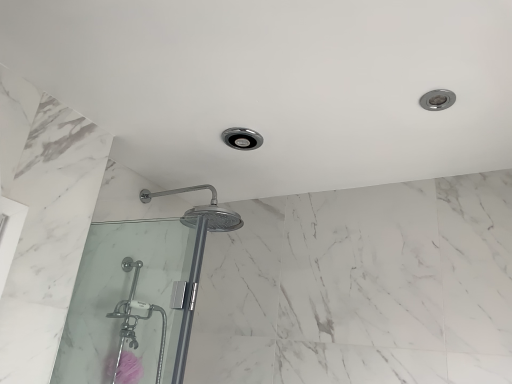
Question: Is pink matte flower at lower left further to the viewer compared to clear glass shower door at lower left?

Choices:
 (A) no
 (B) yes

Answer: (B)

Question: Is pink matte flower at lower left positioned beyond the bounds of clear glass shower door at lower left?

Choices:
 (A) no
 (B) yes

Answer: (B)

Question: Considering the relative sizes of pink matte flower at lower left and clear glass shower door at lower left in the image provided, is pink matte flower at lower left shorter than clear glass shower door at lower left?

Choices:
 (A) yes
 (B) no

Answer: (A)

Question: Considering the relative positions of pink matte flower at lower left and clear glass shower door at lower left in the image provided, is pink matte flower at lower left in front of clear glass shower door at lower left?

Choices:
 (A) yes
 (B) no

Answer: (B)

Question: Does pink matte flower at lower left have a lesser width compared to clear glass shower door at lower left?

Choices:
 (A) yes
 (B) no

Answer: (B)

Question: Is pink matte flower at lower left oriented towards clear glass shower door at lower left?

Choices:
 (A) yes
 (B) no

Answer: (B)

Question: Is clear glass shower door at lower left facing towards pink matte flower at lower left?

Choices:
 (A) yes
 (B) no

Answer: (B)

Question: Would you say clear glass shower door at lower left contains pink matte flower at lower left?

Choices:
 (A) no
 (B) yes

Answer: (A)

Question: Is clear glass shower door at lower left thinner than pink matte flower at lower left?

Choices:
 (A) no
 (B) yes

Answer: (B)

Question: From a real-world perspective, is clear glass shower door at lower left located higher than pink matte flower at lower left?

Choices:
 (A) yes
 (B) no

Answer: (A)

Question: Is clear glass shower door at lower left shorter than pink matte flower at lower left?

Choices:
 (A) no
 (B) yes

Answer: (A)

Question: From the image's perspective, is clear glass shower door at lower left beneath pink matte flower at lower left?

Choices:
 (A) no
 (B) yes

Answer: (A)

Question: From a real-world perspective, is clear glass shower door at lower left physically located above or below pink matte flower at lower left?

Choices:
 (A) above
 (B) below

Answer: (A)